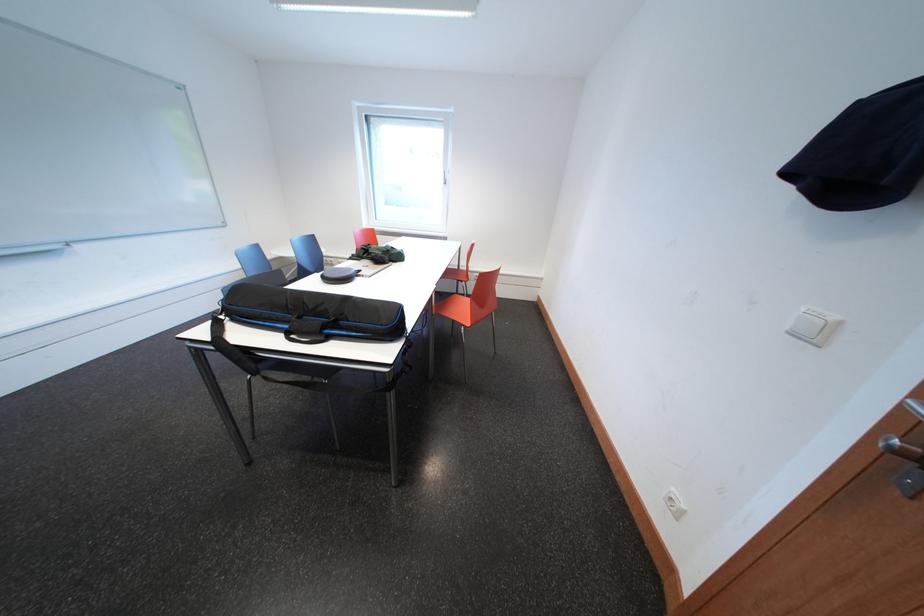
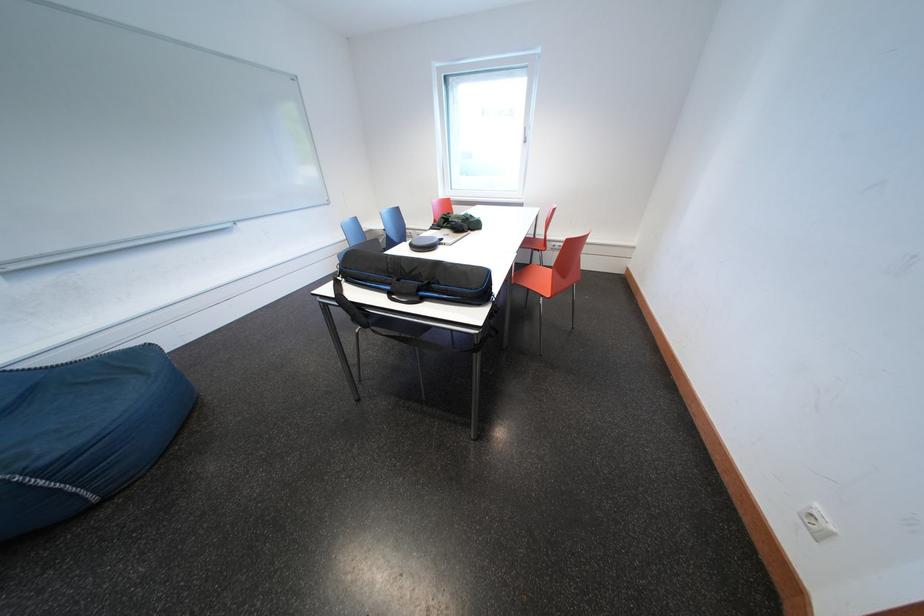
In the second image, find the point that corresponds to point 336,342 in the first image.

(431, 304)